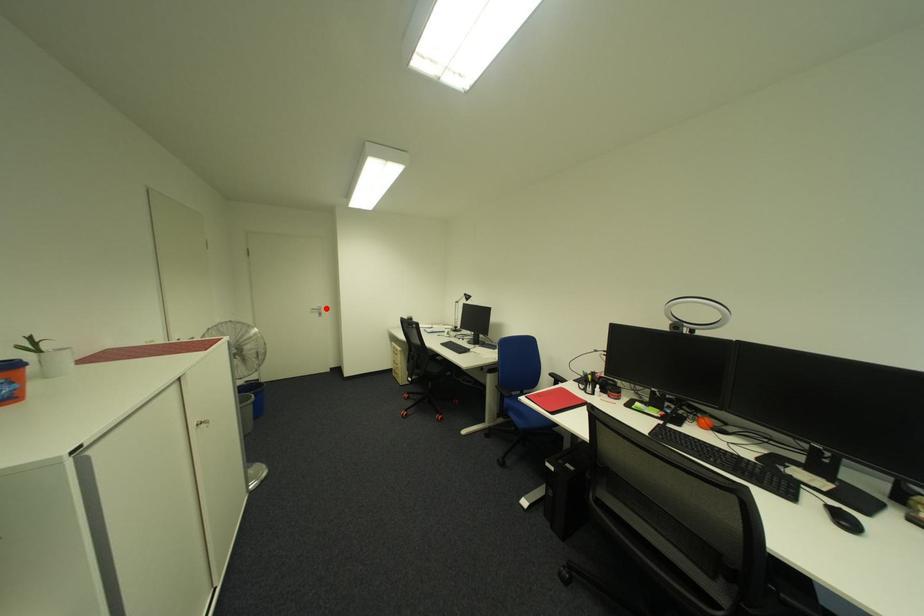
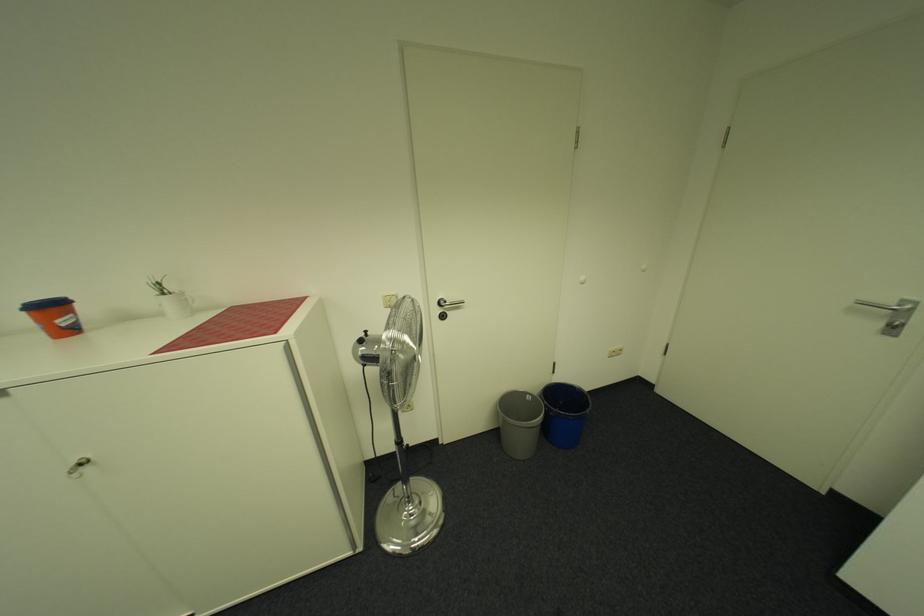
The point at the highlighted location is marked in the first image. Where is the corresponding point in the second image?

(898, 302)